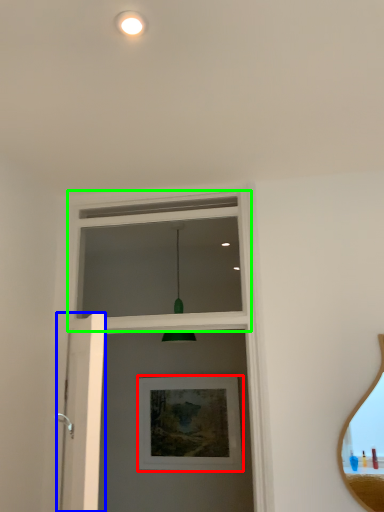
Question: Which object is the closest to the picture frame (highlighted by a red box)? Choose among these: screen door (highlighted by a blue box) or window frame (highlighted by a green box).

Choices:
 (A) screen door
 (B) window frame

Answer: (B)